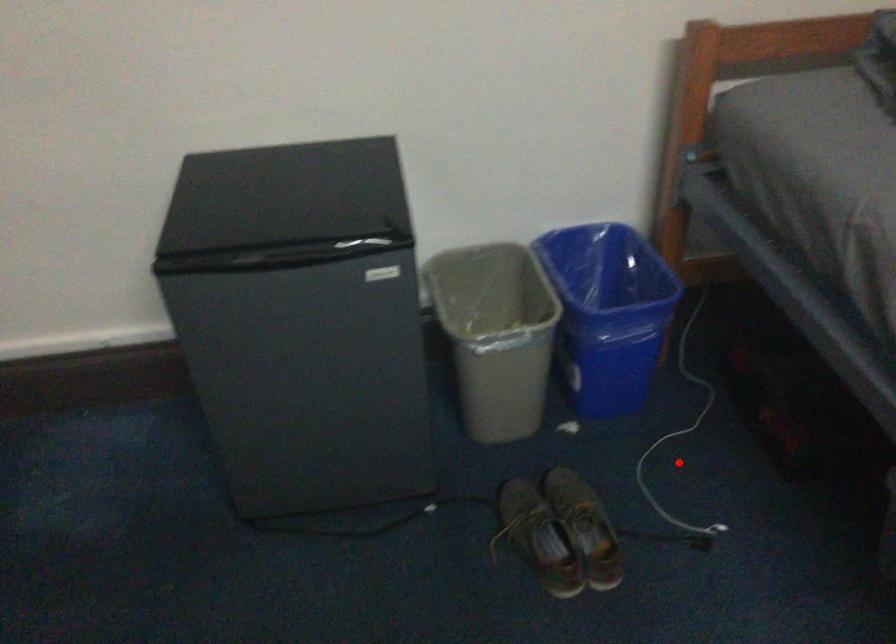
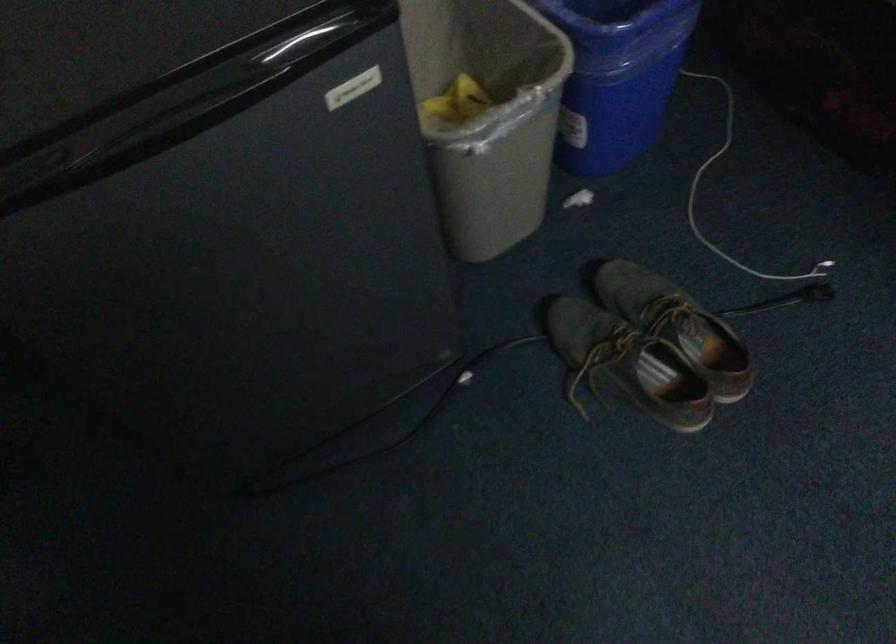
Question: A red point is marked in image1. In image2, is the corresponding 3D point closer to the camera or farther? Reply with the corresponding letter.

Choices:
 (A) The corresponding 3D point is closer.
 (B) The corresponding 3D point is farther.

Answer: (A)